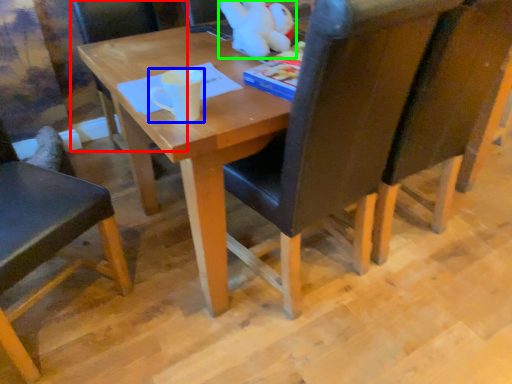
Question: Which is nearer to the chair (highlighted by a red box)? coffee cup (highlighted by a blue box) or toy (highlighted by a green box).

Choices:
 (A) coffee cup
 (B) toy

Answer: (B)